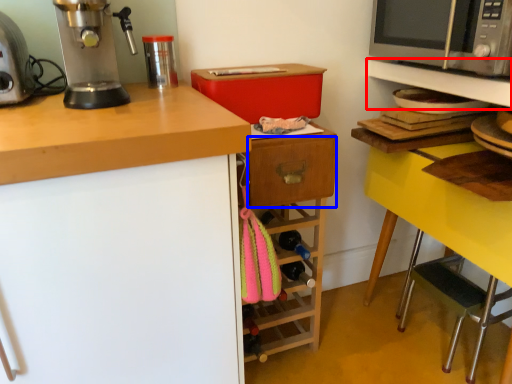
Question: Which object appears closest to the camera in this image, shelf (highlighted by a red box) or drawer (highlighted by a blue box)?

Choices:
 (A) shelf
 (B) drawer

Answer: (A)